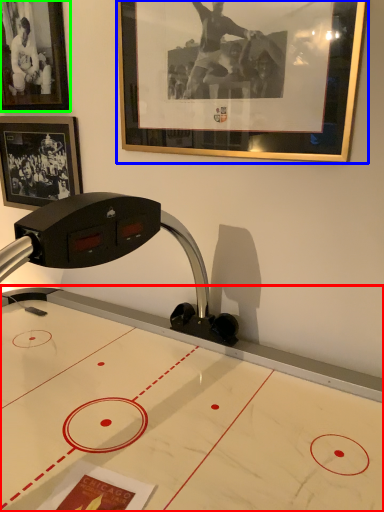
Question: Estimate the real-world distances between objects in this image. Which object is farther from table (highlighted by a red box), picture frame (highlighted by a blue box) or picture frame (highlighted by a green box)?

Choices:
 (A) picture frame
 (B) picture frame

Answer: (B)